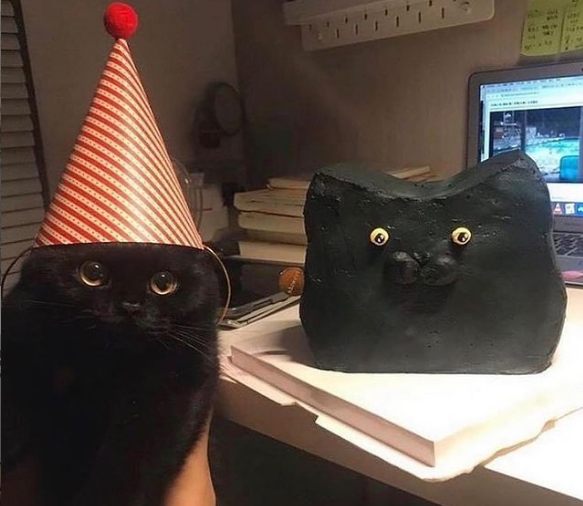
The image size is (583, 506). Find the location of `cat statue's nose`. cat statue's nose is located at coordinates (419, 266).